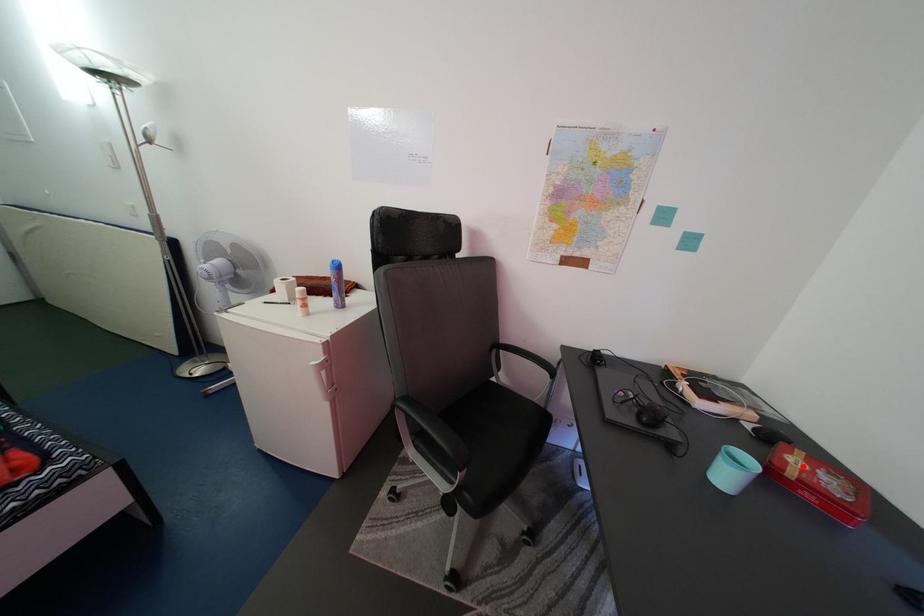
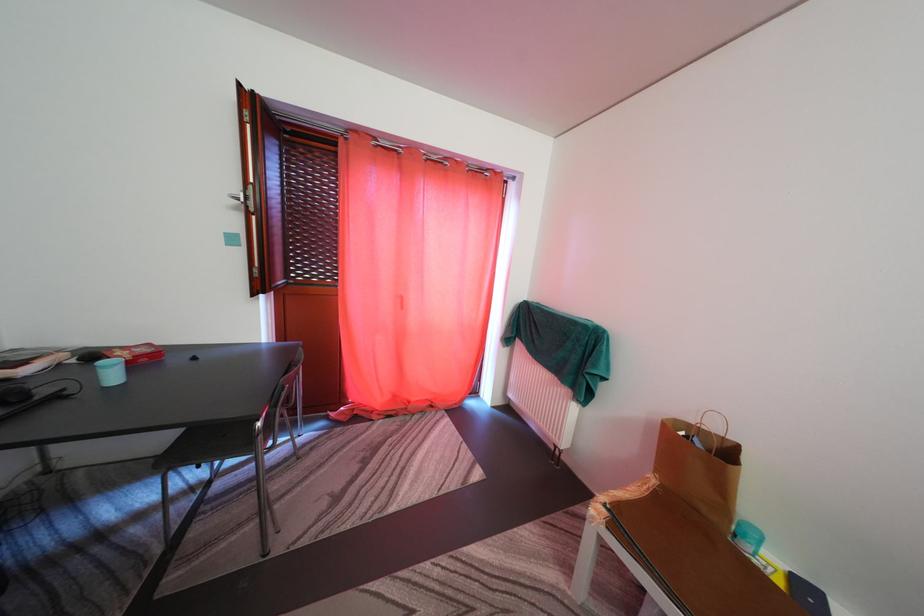
In the second image, find the point that corresponds to the highlighted location in the first image.

(128, 360)